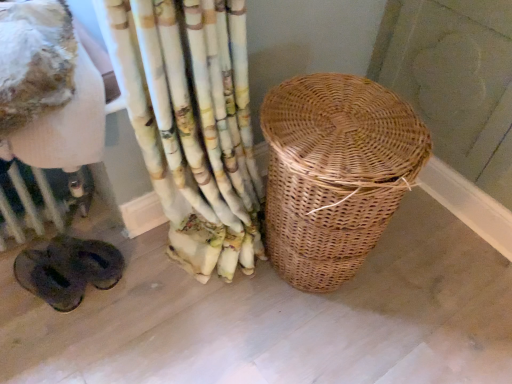
This screenshot has width=512, height=384. Identify the location of unoccupied area in front of woven brown basket at center. (300, 345).